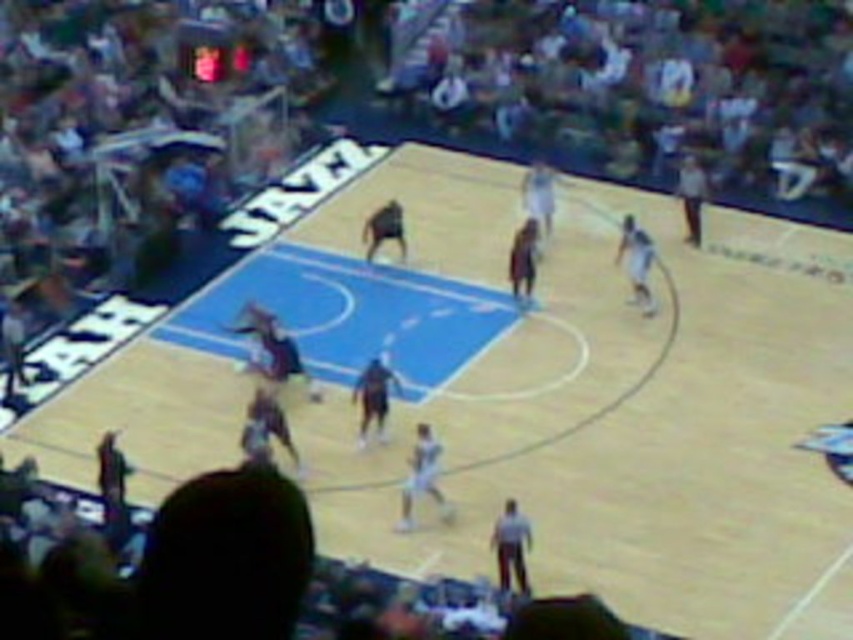
Question: Can you confirm if light brown leather jacket at right is positioned above matte black basketball player at center?

Choices:
 (A) yes
 (B) no

Answer: (A)

Question: Considering the real-world distances, which object is closest to the light gray uniform at center?

Choices:
 (A) dark brown jersey at center
 (B) dark brown shorts at center

Answer: (B)

Question: Among these points, which one is nearest to the camera?

Choices:
 (A) (374, 390)
 (B) (369, 228)

Answer: (A)

Question: Can you confirm if dark brown shorts at center is wider than light brown leather jacket at right?

Choices:
 (A) no
 (B) yes

Answer: (B)

Question: Which point is farther to the camera?

Choices:
 (A) (641, 304)
 (B) (515, 272)
 (C) (399, 205)
 (D) (378, 396)

Answer: (C)

Question: Is dark brown shorts at center in front of matte black basketball player at center?

Choices:
 (A) no
 (B) yes

Answer: (B)